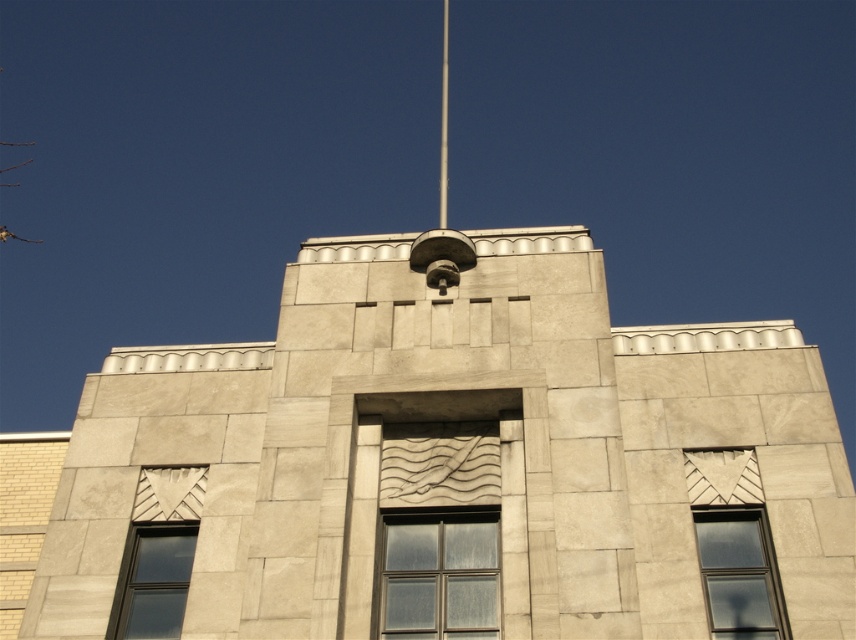
You are an architect examining the building facade. You need to install a new decorative panel that must fit within the space of either the clear glass window at center or the matte glass window at lower left. Which window should you choose to ensure the panel fits without exceeding its width?

The clear glass window at center has a larger width than the matte glass window at lower left, so you should choose the clear glass window at center to ensure the panel fits without exceeding its width.

You are an architect examining the building facade. You notice the clear glass window at center and the matte glass window at lower right. Which window is located below the other?

The clear glass window at center is positioned under the matte glass window at lower right.